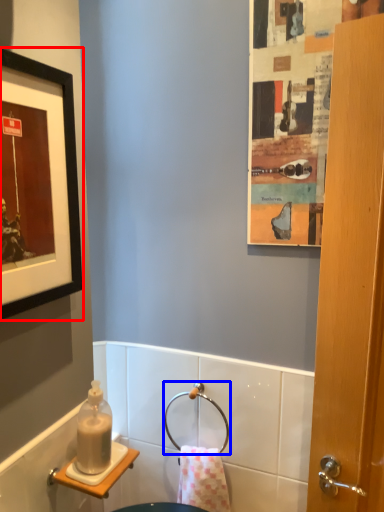
Question: Among these objects, which one is farthest to the camera, picture frame (highlighted by a red box) or towel bar (highlighted by a blue box)?

Choices:
 (A) picture frame
 (B) towel bar

Answer: (B)